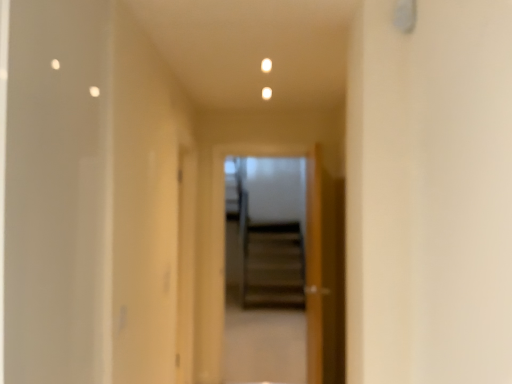
Question: From the image's perspective, relative to wooden door at center, is transparent glass screen door at center above or below?

Choices:
 (A) below
 (B) above

Answer: (B)

Question: Is transparent glass screen door at center to the left or to the right of wooden door at center in the image?

Choices:
 (A) left
 (B) right

Answer: (A)

Question: From their relative heights in the image, would you say transparent glass screen door at center is taller or shorter than wooden door at center?

Choices:
 (A) tall
 (B) short

Answer: (A)

Question: In terms of size, does wooden door at center appear bigger or smaller than transparent glass screen door at center?

Choices:
 (A) big
 (B) small

Answer: (A)

Question: Considering the positions of point (305, 238) and point (286, 198), is point (305, 238) closer or farther from the camera than point (286, 198)?

Choices:
 (A) farther
 (B) closer

Answer: (B)

Question: From a real-world perspective, is wooden door at center positioned above or below transparent glass screen door at center?

Choices:
 (A) below
 (B) above

Answer: (A)

Question: Considering the positions of wooden door at center and transparent glass screen door at center in the image, is wooden door at center wider or thinner than transparent glass screen door at center?

Choices:
 (A) thin
 (B) wide

Answer: (B)